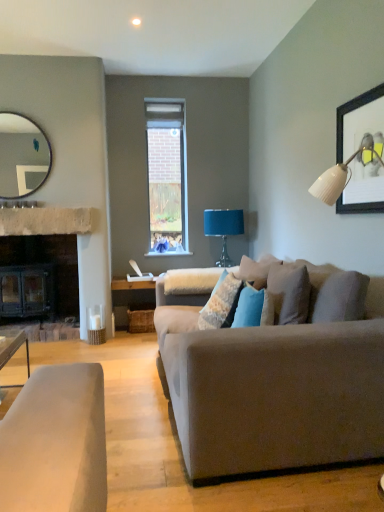
Find the location of a particular element. This screenshot has height=512, width=384. free spot above matte silver mirror at upper left (from a real-world perspective) is located at coordinates (24, 110).